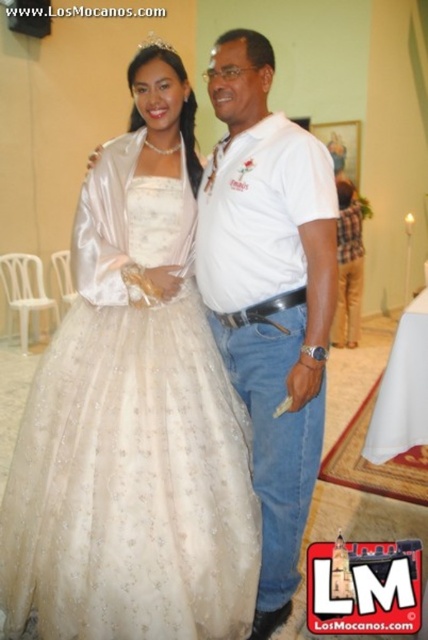
The image size is (428, 640). What do you see at coordinates (130, 444) in the screenshot?
I see `satin/embroidered dress at center` at bounding box center [130, 444].

Does satin/embroidered dress at center have a lesser height compared to white cotton shirt at center?

Indeed, satin/embroidered dress at center has a lesser height compared to white cotton shirt at center.

Is point (95, 438) closer to camera compared to point (273, 371)?

Yes.

The height and width of the screenshot is (640, 428). I want to click on satin/embroidered dress at center, so click(130, 444).